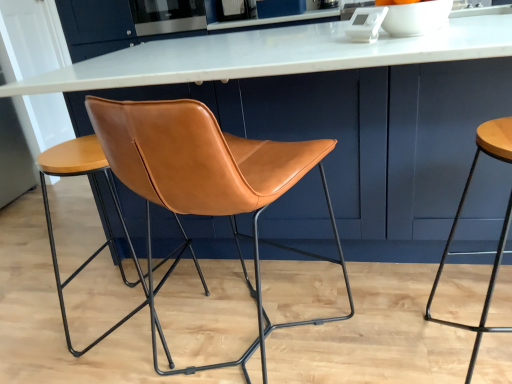
Question: Considering the relative sizes of matte brown stool at right, which is the 1th stool from right to left, and satin stainless steel oven at upper center in the image provided, is matte brown stool at right, which is the 1th stool from right to left, smaller than satin stainless steel oven at upper center?

Choices:
 (A) yes
 (B) no

Answer: (B)

Question: Is matte brown stool at right, marked as the second stool in a left-to-right arrangement, not close to satin stainless steel oven at upper center?

Choices:
 (A) no
 (B) yes

Answer: (B)

Question: Is matte brown stool at right, marked as the second stool in a left-to-right arrangement, positioned behind satin stainless steel oven at upper center?

Choices:
 (A) no
 (B) yes

Answer: (A)

Question: Can satin stainless steel oven at upper center be found inside matte brown stool at right, marked as the second stool in a left-to-right arrangement?

Choices:
 (A) no
 (B) yes

Answer: (A)

Question: Does matte brown stool at right, which is the 1th stool from right to left, have a greater width compared to satin stainless steel oven at upper center?

Choices:
 (A) yes
 (B) no

Answer: (A)

Question: Can you confirm if matte brown stool at right, which is the 1th stool from right to left, is positioned to the left of satin stainless steel oven at upper center?

Choices:
 (A) no
 (B) yes

Answer: (A)

Question: Is white marble table at center far away from satin stainless steel oven at upper center?

Choices:
 (A) no
 (B) yes

Answer: (B)

Question: Is satin stainless steel oven at upper center located within white marble table at center?

Choices:
 (A) yes
 (B) no

Answer: (B)

Question: Is white marble table at center positioned behind satin stainless steel oven at upper center?

Choices:
 (A) yes
 (B) no

Answer: (B)

Question: Can you confirm if white marble table at center is positioned to the left of satin stainless steel oven at upper center?

Choices:
 (A) yes
 (B) no

Answer: (B)

Question: From a real-world perspective, is white marble table at center located higher than satin stainless steel oven at upper center?

Choices:
 (A) no
 (B) yes

Answer: (A)

Question: Considering the relative sizes of white marble table at center and satin stainless steel oven at upper center in the image provided, is white marble table at center wider than satin stainless steel oven at upper center?

Choices:
 (A) yes
 (B) no

Answer: (A)

Question: From the image's perspective, is white marble table at center located above leather at center, acting as the 2th stool starting from the right?

Choices:
 (A) yes
 (B) no

Answer: (A)